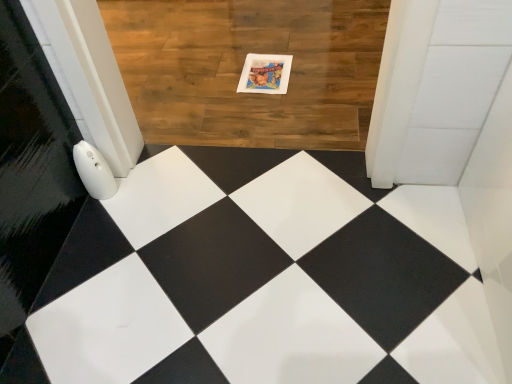
Image resolution: width=512 pixels, height=384 pixels. I want to click on vacant area on the back side of matte paper postcard at center, so 260,45.